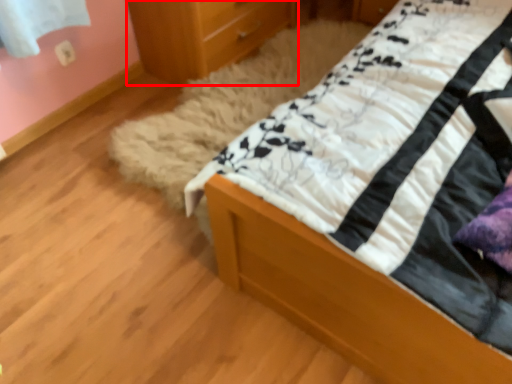
Question: From the image, what is the correct spatial relationship of chest of drawers (annotated by the red box) in relation to bed?

Choices:
 (A) left
 (B) right

Answer: (A)